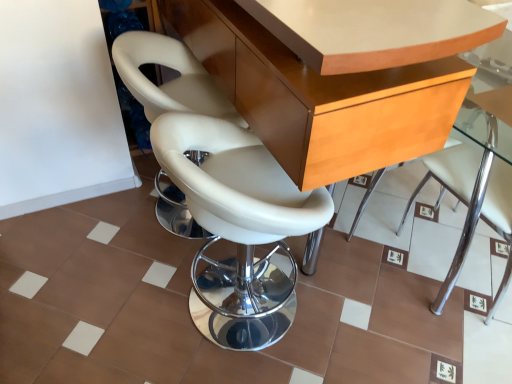
Question: Is white leather chair at center, which ranks as the 3th chair in right-to-left order, facing away from white leather chair at center, which ranks as the 1th chair in right-to-left order?

Choices:
 (A) yes
 (B) no

Answer: (B)

Question: Does white leather chair at center, which ranks as the 3th chair in right-to-left order, have a lesser width compared to white leather chair at center, which ranks as the 3th chair in left-to-right order?

Choices:
 (A) no
 (B) yes

Answer: (B)

Question: From a real-world perspective, is white leather chair at center, which is counted as the first chair, starting from the left, physically below white leather chair at center, which ranks as the 3th chair in left-to-right order?

Choices:
 (A) yes
 (B) no

Answer: (A)

Question: Does white leather chair at center, which is counted as the first chair, starting from the left, lie in front of white leather chair at center, which ranks as the 1th chair in right-to-left order?

Choices:
 (A) yes
 (B) no

Answer: (B)

Question: Is white leather chair at center, which ranks as the 3th chair in right-to-left order, far away from white leather chair at center, which ranks as the 3th chair in left-to-right order?

Choices:
 (A) no
 (B) yes

Answer: (B)

Question: Can you confirm if white leather chair at center, which is counted as the first chair, starting from the left, is positioned to the left of white leather chair at center, which ranks as the 3th chair in left-to-right order?

Choices:
 (A) yes
 (B) no

Answer: (A)

Question: Can you confirm if white leather chair at center, the 2th chair in the left-to-right sequence, is thinner than light brown wood table at center?

Choices:
 (A) yes
 (B) no

Answer: (A)

Question: Can you confirm if white leather chair at center, the 2th chair in the left-to-right sequence, is smaller than light brown wood table at center?

Choices:
 (A) yes
 (B) no

Answer: (A)

Question: From the image's perspective, does white leather chair at center, the 2th chair in the left-to-right sequence, appear lower than light brown wood table at center?

Choices:
 (A) no
 (B) yes

Answer: (B)

Question: From a real-world perspective, is white leather chair at center, the 2th chair in the left-to-right sequence, located higher than light brown wood table at center?

Choices:
 (A) no
 (B) yes

Answer: (A)

Question: Would you say white leather chair at center, the 2th chair in the left-to-right sequence, contains light brown wood table at center?

Choices:
 (A) no
 (B) yes

Answer: (A)

Question: From the image's perspective, is white leather chair at center, the 2th chair in the left-to-right sequence, located above light brown wood table at center?

Choices:
 (A) no
 (B) yes

Answer: (A)

Question: Is white leather chair at center, which ranks as the 3th chair in left-to-right order, behind white leather chair at center, the 2th chair in the left-to-right sequence?

Choices:
 (A) no
 (B) yes

Answer: (B)